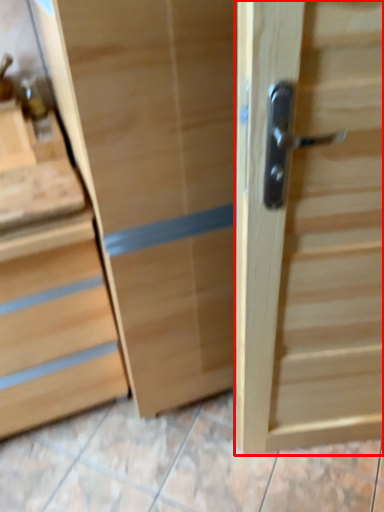
Question: From the image, what is the correct spatial relationship of door (annotated by the red box) in relation to chest of drawers?

Choices:
 (A) left
 (B) right

Answer: (B)